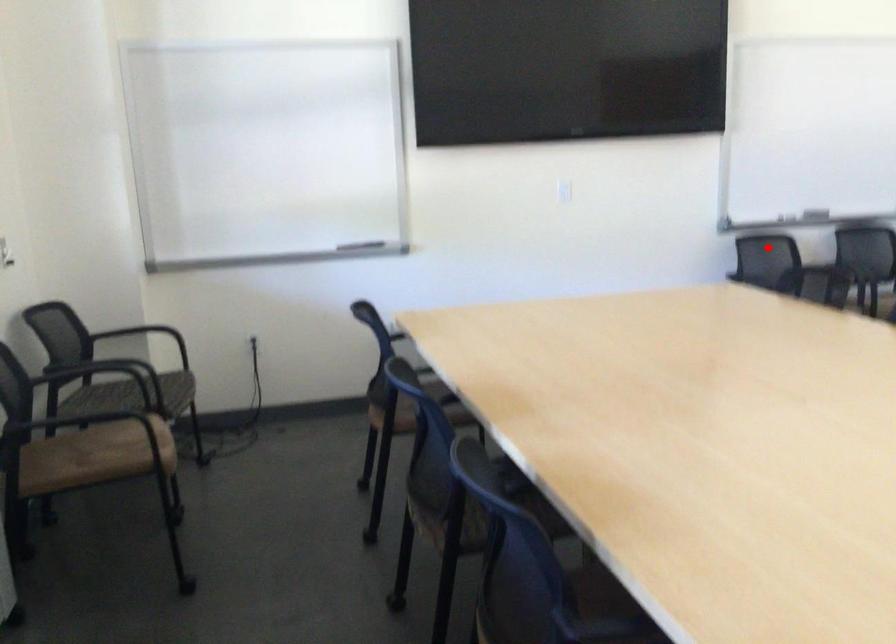
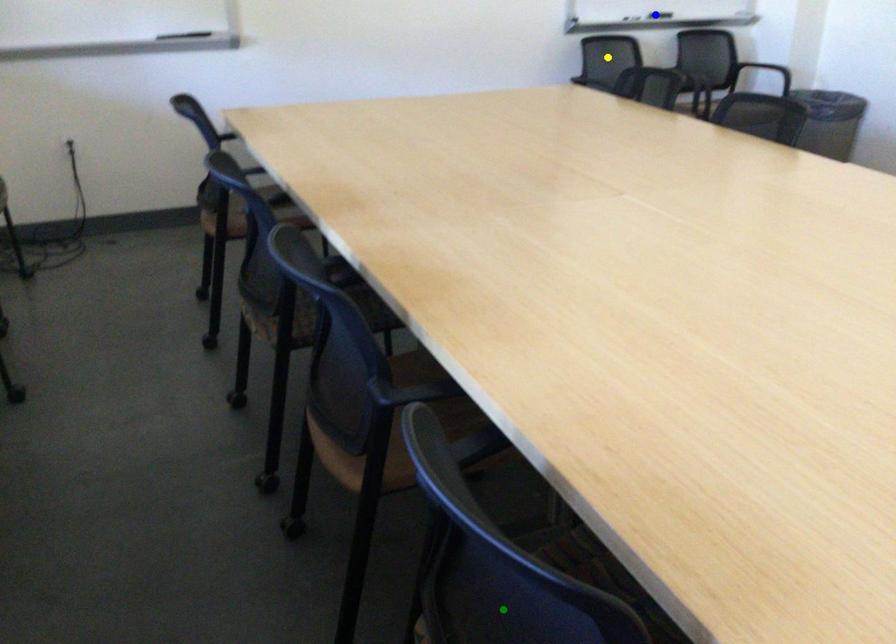
Question: I am providing you with two images of the same scene from different viewpoints. A red point is marked on the first image. You are given multiple points on the second image. Which spot in image 2 lines up with the point in image 1?

Choices:
 (A) green point
 (B) yellow point
 (C) blue point

Answer: (B)